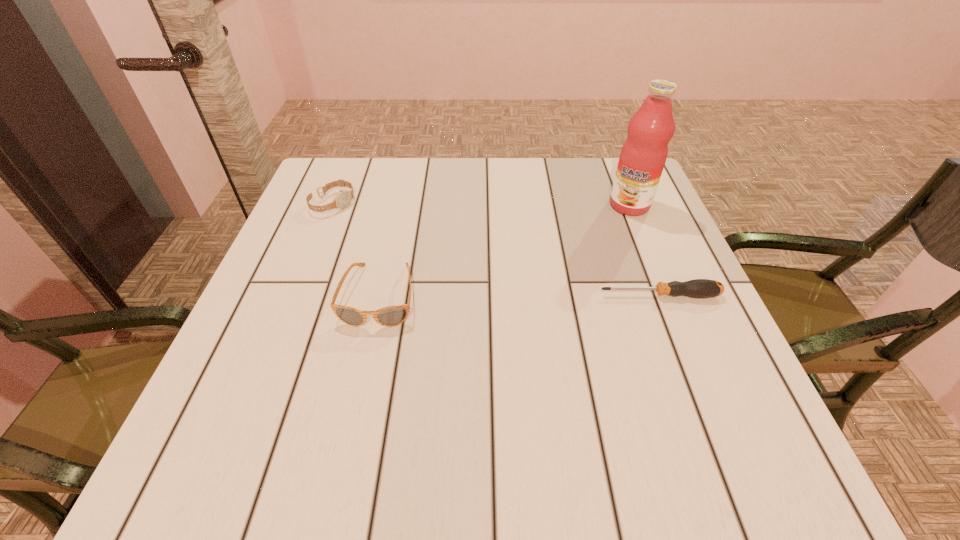
In the image, there is a desktop. Find the location of `vacant space at the left edge`. vacant space at the left edge is located at coordinates (281, 245).

Where is `free spot at the right edge of the desktop`? free spot at the right edge of the desktop is located at coordinates (683, 319).

Where is `vacant space at the far left corner`? Image resolution: width=960 pixels, height=540 pixels. vacant space at the far left corner is located at coordinates (343, 160).

In the image, there is a desktop. Where is `vacant space at the near right corner`? vacant space at the near right corner is located at coordinates (662, 392).

Locate an element on the screen. vacant area that lies between the screwdriver and the third object from right to left is located at coordinates (519, 295).

Image resolution: width=960 pixels, height=540 pixels. Find the location of `vacant space that is in between the fruit juice and the leftmost object`. vacant space that is in between the fruit juice and the leftmost object is located at coordinates (481, 204).

What are the coordinates of `free spot between the watch and the shortest object` in the screenshot? It's located at (496, 249).

Where is `vacant area that lies between the leftmost object and the second object from left to right`? This screenshot has width=960, height=540. vacant area that lies between the leftmost object and the second object from left to right is located at coordinates (356, 249).

Identify the location of free space that is in between the screwdriver and the second object from left to right. The image size is (960, 540). (519, 295).

Where is `vacant space that's between the tallest object and the shortest object`? The height and width of the screenshot is (540, 960). vacant space that's between the tallest object and the shortest object is located at coordinates (644, 250).